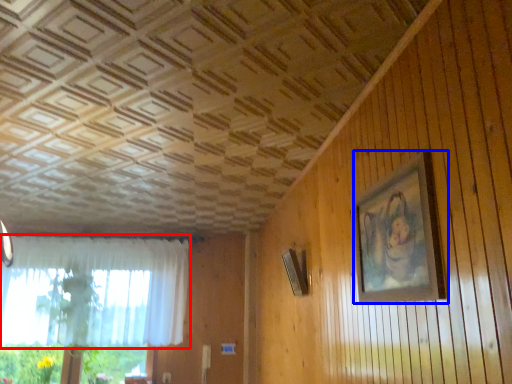
Question: Which object appears farthest to the camera in this image, curtain (highlighted by a red box) or picture frame (highlighted by a blue box)?

Choices:
 (A) curtain
 (B) picture frame

Answer: (A)